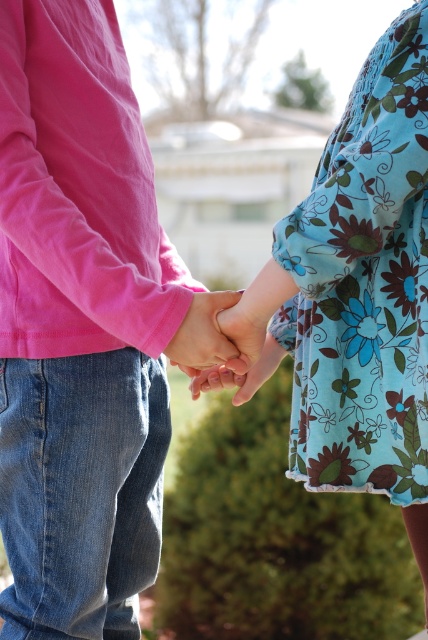
You are a photographer focusing on the hands of two people in the image. You notice the floral fabric dress at center and the matte pink hand at center. Which object is closer to the camera lens?

The floral fabric dress at center is closer to the viewer than the matte pink hand at center, so the floral fabric dress at center is closer to the camera lens.

You are a photographer trying to capture a detailed shot of the floral fabric dress at center and the matte pink hand at center. Since you want to focus on the intricate patterns of the dress, which object should you ensure is wider in your composition?

The floral fabric dress at center is wider than the matte pink hand at center, so you should ensure the floral fabric dress at center is wider in your composition to highlight its intricate patterns.